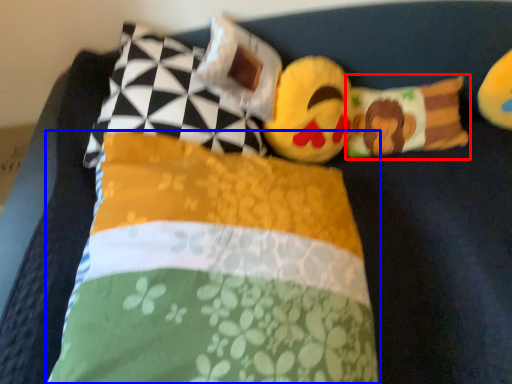
Question: Which object appears closest to the camera in this image, pillow (highlighted by a red box) or pillow (highlighted by a blue box)?

Choices:
 (A) pillow
 (B) pillow

Answer: (B)